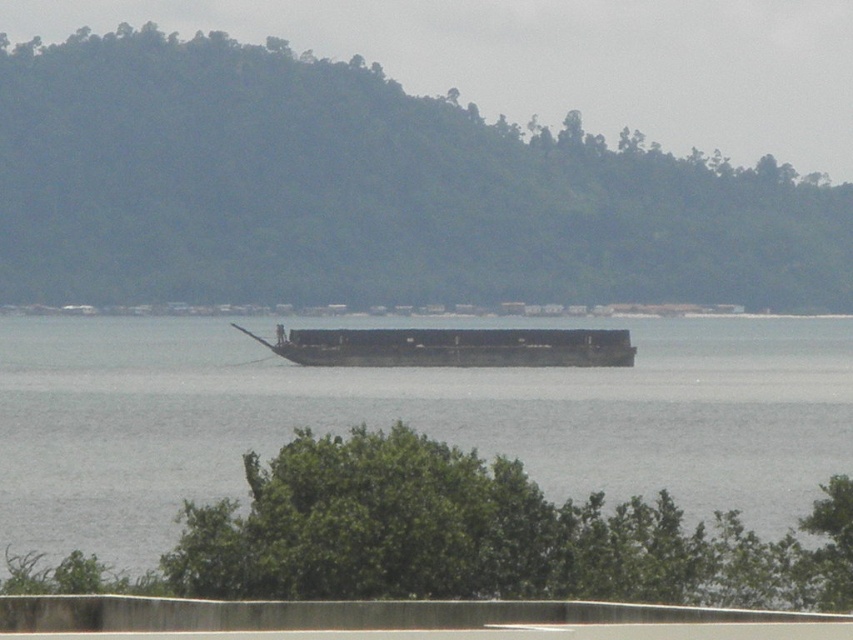
Question: Which of the following is the closest to the observer?

Choices:
 (A) (755, 387)
 (B) (32, 120)
 (C) (569, 353)

Answer: (A)

Question: Can you confirm if green forested hill at center is wider than dark gray metallic barge at center?

Choices:
 (A) no
 (B) yes

Answer: (B)

Question: Does brown wooden boat at center lie behind dark gray metallic barge at center?

Choices:
 (A) no
 (B) yes

Answer: (A)

Question: Which point appears farthest from the camera in this image?

Choices:
 (A) (466, 422)
 (B) (285, 182)
 (C) (520, 333)

Answer: (B)

Question: Which point is farther from the camera taking this photo?

Choices:
 (A) (589, 188)
 (B) (437, 333)
 (C) (36, 541)

Answer: (A)

Question: In this image, where is green forested hill at center located relative to dark gray metallic barge at center?

Choices:
 (A) below
 (B) above

Answer: (B)